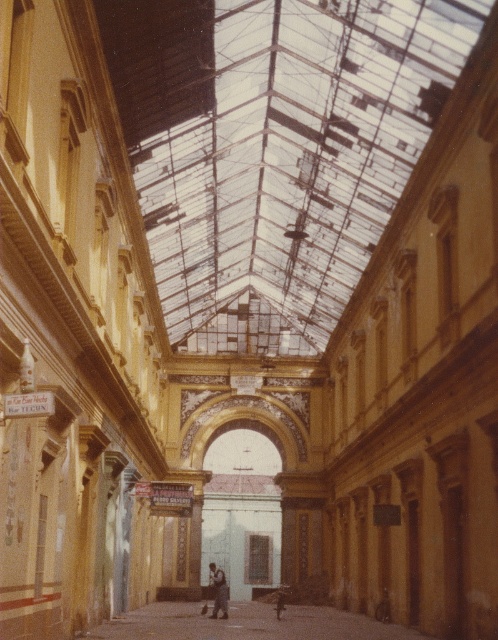
Is smooth concrete alley at center to the right of dark blue jeans at center from the viewer's perspective?

Correct, you'll find smooth concrete alley at center to the right of dark blue jeans at center.

Which of these two, smooth concrete alley at center or dark blue jeans at center, stands shorter?

dark blue jeans at center is shorter.

You are a GUI agent. You are given a task and a screenshot of the screen. Output one action in this format:
    pyautogui.click(x=<x>, y=<y>)
    Task: Click on the smooth concrete alley at center
    The image size is (498, 640).
    Given the screenshot: What is the action you would take?
    pyautogui.click(x=247, y=624)